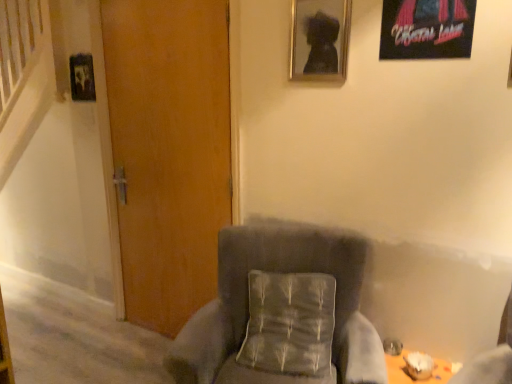
Question: Considering the positions of metallic poster at upper right, acting as the first picture frame starting from the front, and velvet gray armchair at center in the image, is metallic poster at upper right, acting as the first picture frame starting from the front, wider or thinner than velvet gray armchair at center?

Choices:
 (A) wide
 (B) thin

Answer: (B)

Question: Looking at the image, does metallic poster at upper right, arranged as the 3th picture frame when viewed from the left, seem bigger or smaller compared to velvet gray armchair at center?

Choices:
 (A) big
 (B) small

Answer: (B)

Question: Based on their relative distances, which object is farther from the metallic poster at upper right, the third picture frame viewed from the back?

Choices:
 (A) wooden door at center
 (B) metallic silver picture frame at upper left, which is the first picture frame in back-to-front order
 (C) velvet gray armchair at center
 (D) textured gray pillow at center
 (E) matte black picture frame at upper center, which is the second picture frame from right to left

Answer: (B)

Question: Estimate the real-world distances between objects in this image. Which object is farther from the wooden door at center?

Choices:
 (A) velvet gray armchair at center
 (B) metallic poster at upper right, the first picture frame positioned from the right
 (C) textured gray pillow at center
 (D) metallic silver picture frame at upper left, the 1th picture frame in the left-to-right sequence
 (E) matte black picture frame at upper center, which ranks as the 2th picture frame in back-to-front order

Answer: (B)